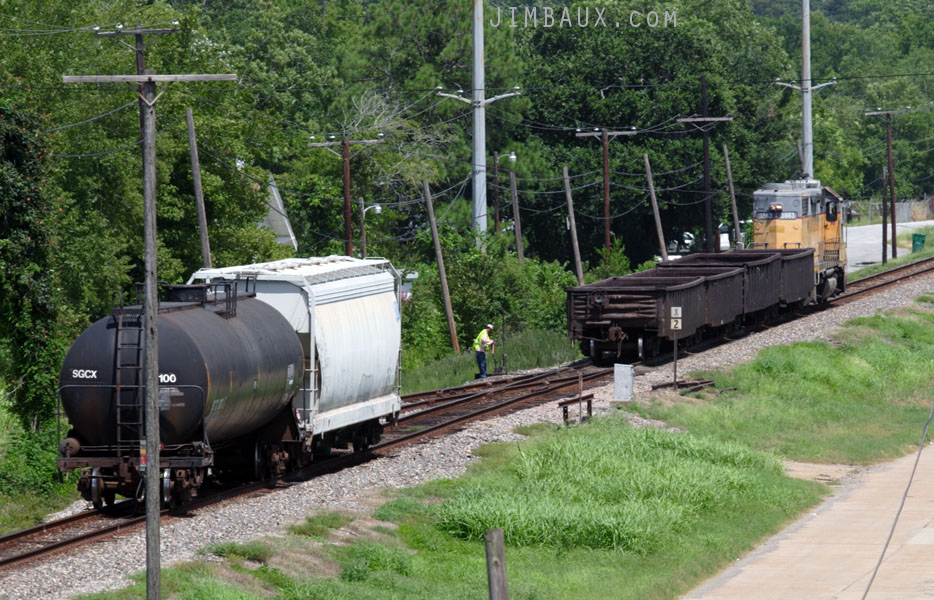
Find the location of a particular element. This screenshot has height=600, width=934. ladder is located at coordinates (134, 370).